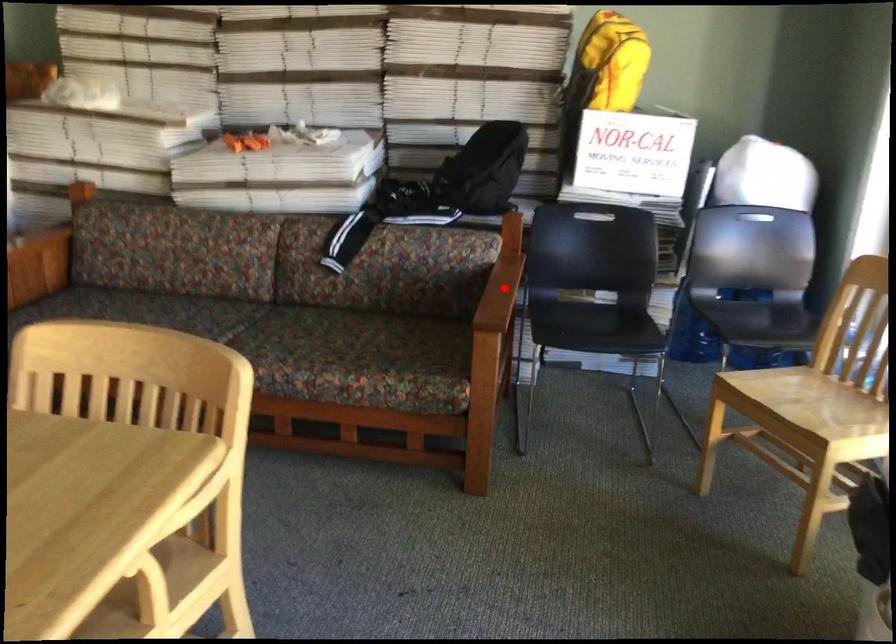
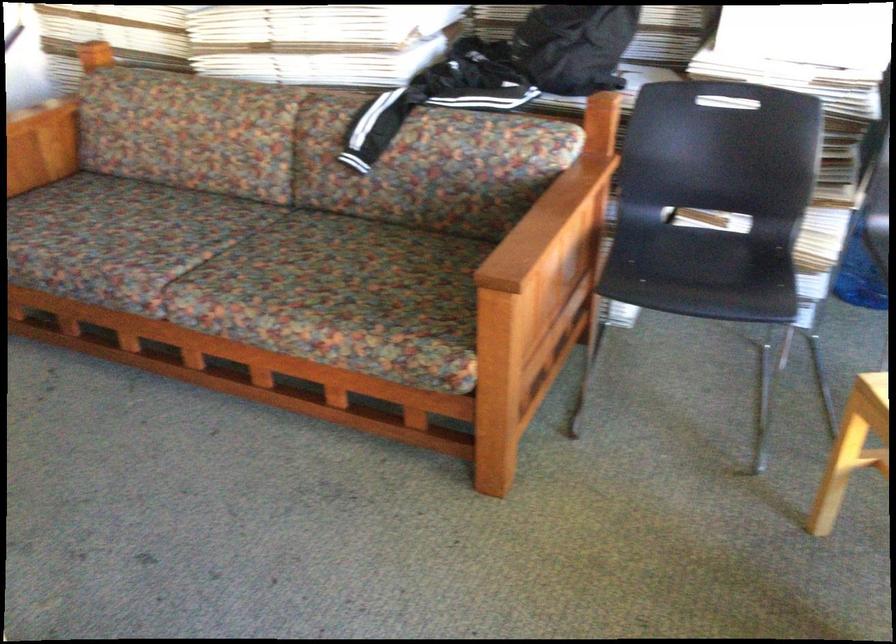
Question: I am providing you with two images of the same scene from different viewpoints. In image1, a red point is highlighted. Considering the same 3D point in image2, which of the following is correct?

Choices:
 (A) It is closer
 (B) It is farther

Answer: (A)